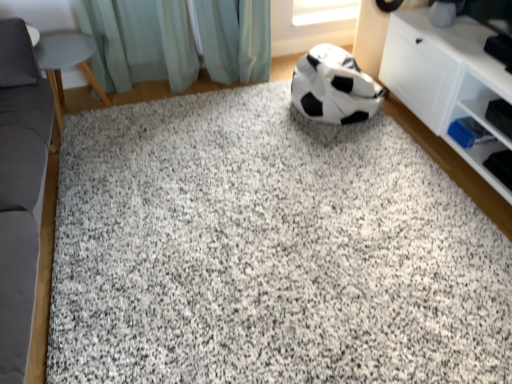
Question: Considering the positions of light teal fabric at upper center and granite at center in the image, is light teal fabric at upper center taller or shorter than granite at center?

Choices:
 (A) tall
 (B) short

Answer: (A)

Question: Considering their positions, is light teal fabric at upper center located in front of or behind granite at center?

Choices:
 (A) behind
 (B) front

Answer: (A)

Question: Which of these objects is positioned farthest from the light teal fabric at upper center?

Choices:
 (A) granite at center
 (B) white matte cabinet at right
 (C) matte gray stool at left, marked as the second furniture in a front-to-back arrangement
 (D) gray fabric couch at left, the first furniture viewed from the front
 (E) black/white matte football at center

Answer: (B)

Question: Which object is the farthest from the matte gray stool at left, which appears as the 1th furniture when viewed from the back?

Choices:
 (A) black/white matte football at center
 (B) gray fabric couch at left, acting as the 2th furniture starting from the back
 (C) white matte cabinet at right
 (D) light teal fabric at upper center
 (E) granite at center

Answer: (C)